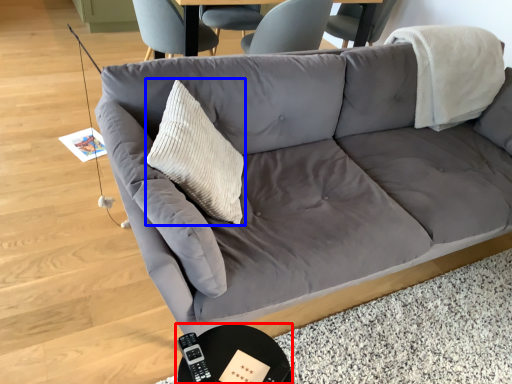
Question: Which point is further to the camera, round table (highlighted by a red box) or throw pillow (highlighted by a blue box)?

Choices:
 (A) round table
 (B) throw pillow

Answer: (B)